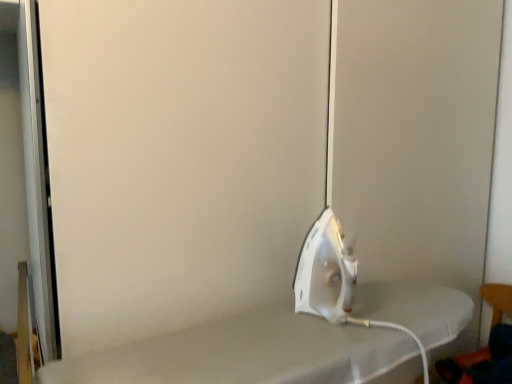
This screenshot has height=384, width=512. What do you see at coordinates (485, 347) in the screenshot?
I see `wooden chair at lower right` at bounding box center [485, 347].

Locate an element on the screen. This screenshot has width=512, height=384. wooden chair at lower right is located at coordinates (485, 347).

In order to face white glossy iron at center, should I rotate leftwards or rightwards?

You should rotate right by 10.828 degrees.

The width and height of the screenshot is (512, 384). Identify the location of white glossy iron at center. (325, 271).

Describe the element at coordinates (325, 271) in the screenshot. I see `white glossy iron at center` at that location.

Locate an element on the screen. The height and width of the screenshot is (384, 512). wooden chair at lower right is located at coordinates (485, 347).

Would you say wooden chair at lower right is to the left or to the right of white glossy iron at center in the picture?

From the image, it's evident that wooden chair at lower right is to the right of white glossy iron at center.

Which object is closer to the camera, wooden chair at lower right or white glossy iron at center?

Positioned in front is white glossy iron at center.

Between point (464, 365) and point (321, 306), which one is positioned in front?

The point (321, 306) is closer to the camera.

From the picture: From the image's perspective, does wooden chair at lower right appear lower than white glossy iron at center?

Yes, from the image's perspective, wooden chair at lower right is below white glossy iron at center.

From a real-world perspective, is wooden chair at lower right on top of white glossy iron at center?

Incorrect, from a real-world perspective, wooden chair at lower right is lower than white glossy iron at center.

Does wooden chair at lower right have a lesser width compared to white glossy iron at center?

No.

Is wooden chair at lower right taller than white glossy iron at center?

Yes.

Can you confirm if wooden chair at lower right is bigger than white glossy iron at center?

Yes.

Would you say wooden chair at lower right is outside white glossy iron at center?

That's correct, wooden chair at lower right is outside of white glossy iron at center.

Can you see wooden chair at lower right touching white glossy iron at center?

No, wooden chair at lower right is not making contact with white glossy iron at center.

Is white glossy iron at center at the back of wooden chair at lower right?

That's not correct — wooden chair at lower right is not looking away from white glossy iron at center.

This screenshot has width=512, height=384. Identify the location of appliance in front of the wooden chair at lower right. (325, 271).

Does white glossy iron at center appear on the left side of wooden chair at lower right?

Yes, white glossy iron at center is to the left of wooden chair at lower right.

In the scene shown: Is white glossy iron at center positioned before wooden chair at lower right?

Yes, it is.

Does point (313, 261) come farther from viewer compared to point (500, 364)?

That is False.

From the image's perspective, relative to wooden chair at lower right, is white glossy iron at center above or below?

Clearly, from the image's perspective, white glossy iron at center is above wooden chair at lower right.

From a real-world perspective, is white glossy iron at center located beneath wooden chair at lower right?

Incorrect, from a real-world perspective, white glossy iron at center is higher than wooden chair at lower right.

Does white glossy iron at center have a lesser width compared to wooden chair at lower right?

Correct, the width of white glossy iron at center is less than that of wooden chair at lower right.

Which of these two, white glossy iron at center or wooden chair at lower right, stands taller?

Standing taller between the two is wooden chair at lower right.

Considering the relative sizes of white glossy iron at center and wooden chair at lower right in the image provided, is white glossy iron at center smaller than wooden chair at lower right?

Indeed, white glossy iron at center has a smaller size compared to wooden chair at lower right.

Is white glossy iron at center not within wooden chair at lower right?

white glossy iron at center is positioned outside wooden chair at lower right.

Are white glossy iron at center and wooden chair at lower right beside each other?

No, white glossy iron at center is not making contact with wooden chair at lower right.

Is wooden chair at lower right at the back of white glossy iron at center?

That's not correct — white glossy iron at center is not looking away from wooden chair at lower right.

Image resolution: width=512 pixels, height=384 pixels. In the image, there is a white glossy iron at center. In order to click on chair below it (from the image's perspective) in this screenshot , I will do `click(485, 347)`.

Locate an element on the screen. The height and width of the screenshot is (384, 512). appliance lying in front of the wooden chair at lower right is located at coordinates (325, 271).

Where is `chair below the white glossy iron at center (from a real-world perspective)`? The height and width of the screenshot is (384, 512). chair below the white glossy iron at center (from a real-world perspective) is located at coordinates (485, 347).